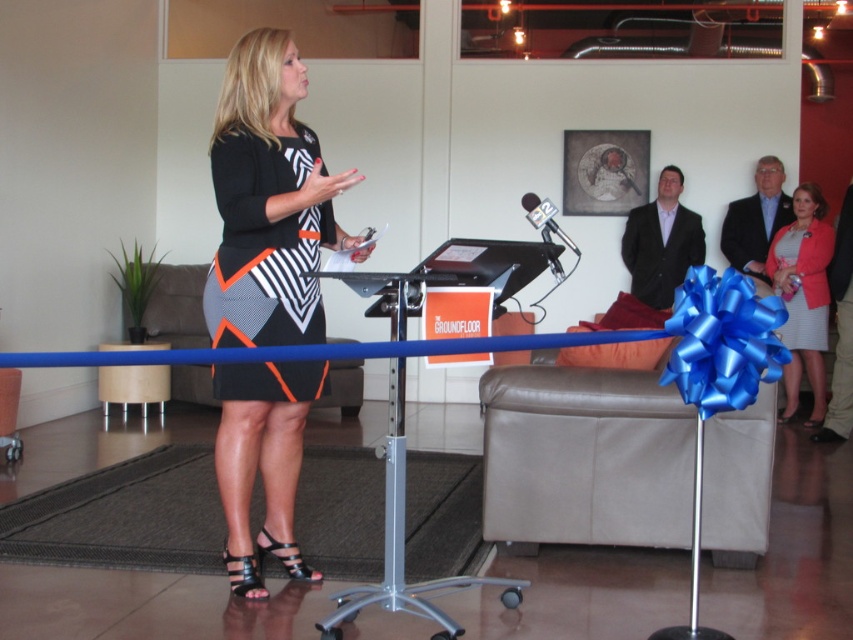
Based on the photo, you are organizing a small event and need to ensure that the matte black dress at right and the black metallic microphone at center are both visible to the audience. Since the microphone is smaller, where should you place them so that both are easily seen?

Since the matte black dress at right is larger than the black metallic microphone at center, place the black metallic microphone at center closer to the audience to ensure it is more prominent and visible alongside the dress.

You are sitting in the front row of the audience and want to see both the black matte dress at center and the matte black dress at right clearly. Which dress will appear larger to you?

The black matte dress at center appears larger because it is closer to you than the matte black dress at right.

You are an event planner organizing a photoshoot for a fashion show. You need to position two models wearing the black matte dress at center and the matte pink blazer at right. Based on the scene description, where should you place the model in the black matte dress relative to the model in the matte pink blazer?

The black matte dress at center should be placed to the left of the matte pink blazer at right, as per the spatial arrangement described.